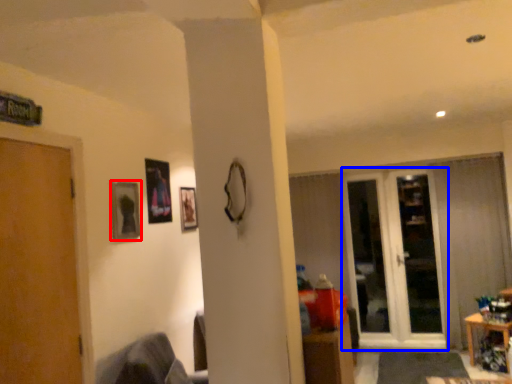
Question: Among these objects, which one is farthest to the camera, picture frame (highlighted by a red box) or glass door (highlighted by a blue box)?

Choices:
 (A) picture frame
 (B) glass door

Answer: (B)